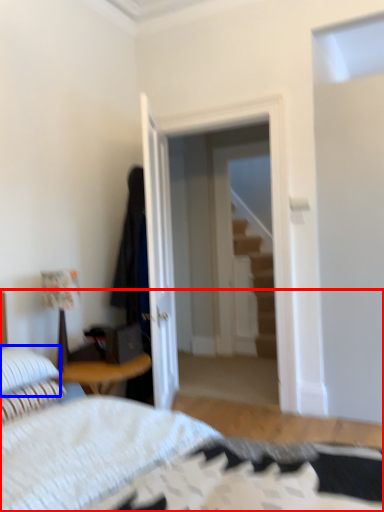
Question: Which object is further to the camera taking this photo, bed (highlighted by a red box) or pillow (highlighted by a blue box)?

Choices:
 (A) bed
 (B) pillow

Answer: (B)